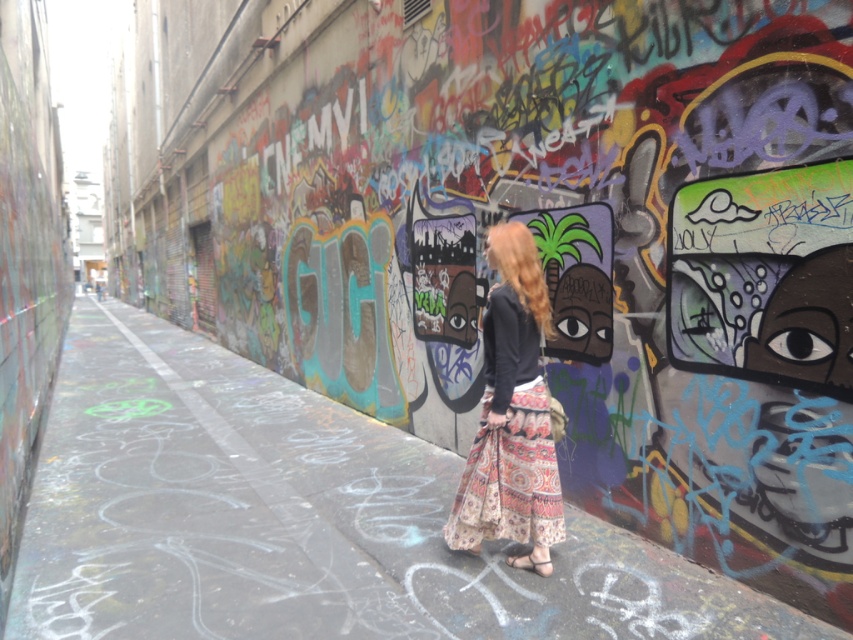
You are a delivery person trying to navigate through the narrow alley. You notice the matte concrete alley at center and the printed cotton skirt at center in your path. Which object is shorter and might require bending down to avoid?

The matte concrete alley at center is shorter than the printed cotton skirt at center, so you should bend down to avoid hitting the printed cotton skirt at center.